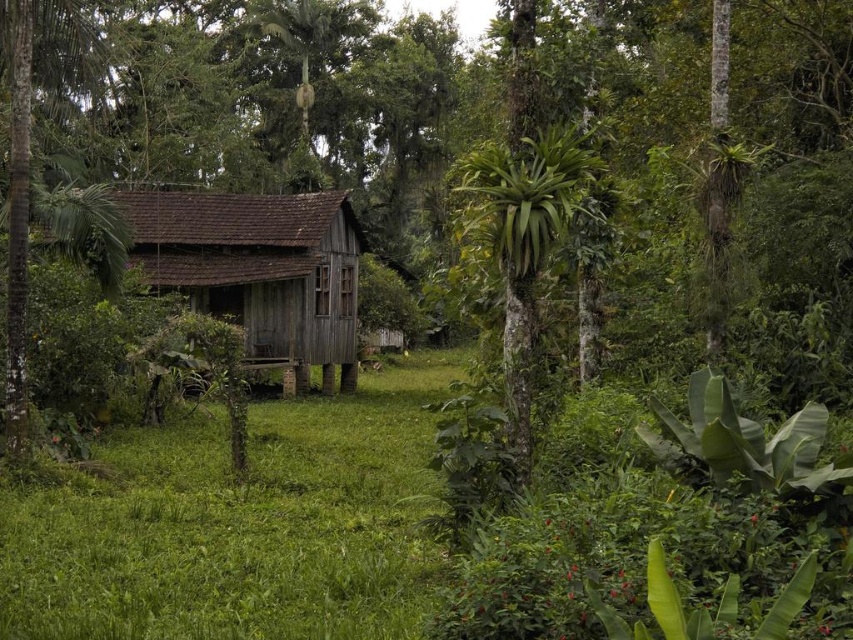
Can you confirm if green grass at center is bigger than weathered wood hut at center?

Actually, green grass at center might be smaller than weathered wood hut at center.

Who is positioned more to the right, green grass at center or weathered wood hut at center?

green grass at center

Does point (273, 531) come closer to viewer compared to point (184, 225)?

Yes, point (273, 531) is closer to viewer.

Locate an element on the screen. This screenshot has width=853, height=640. green grass at center is located at coordinates (239, 525).